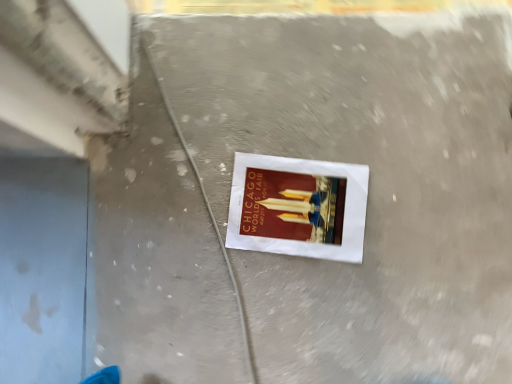
Where is `free location to the left of white paper poster at center`? The image size is (512, 384). free location to the left of white paper poster at center is located at coordinates (194, 203).